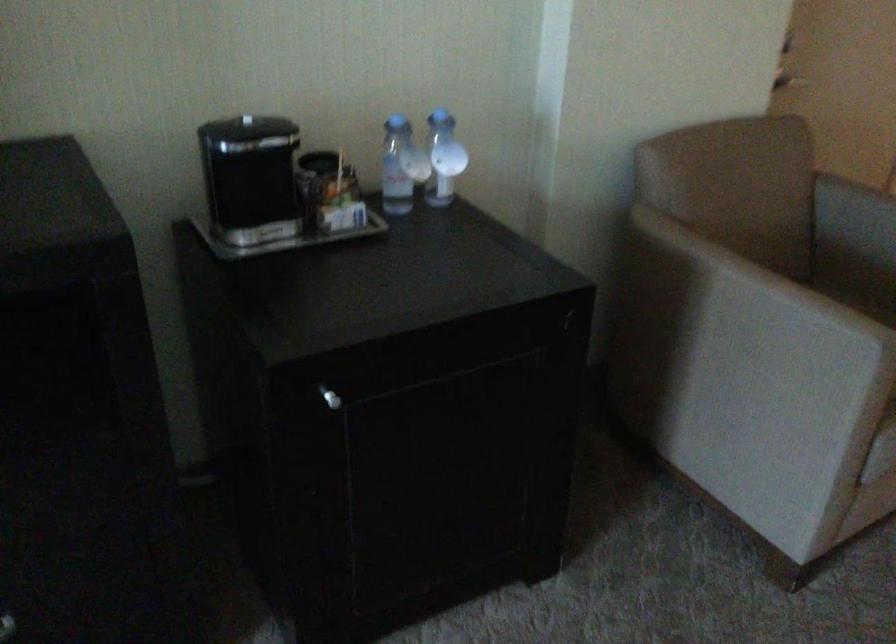
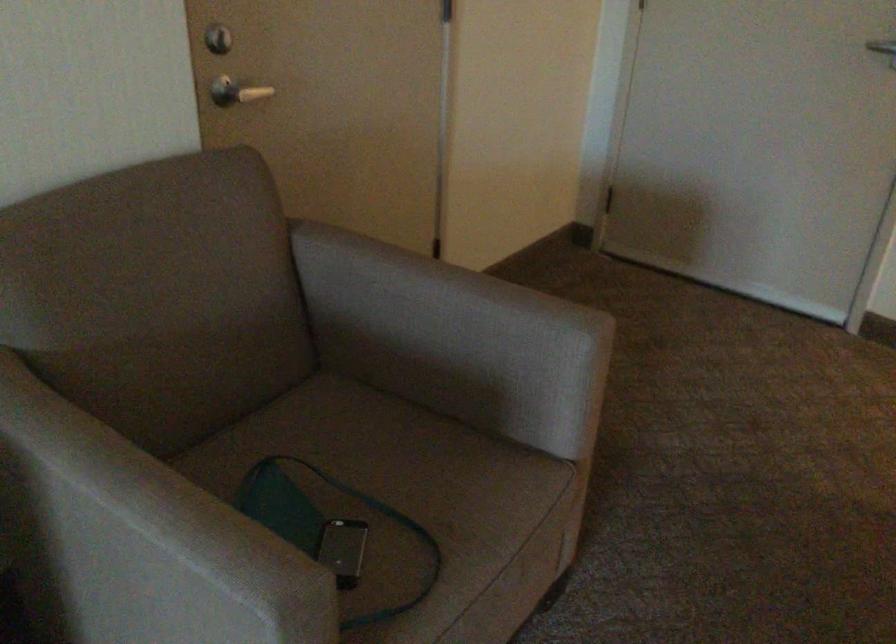
Find the pixel in the second image that matches point 797,68 in the first image.

(236, 91)